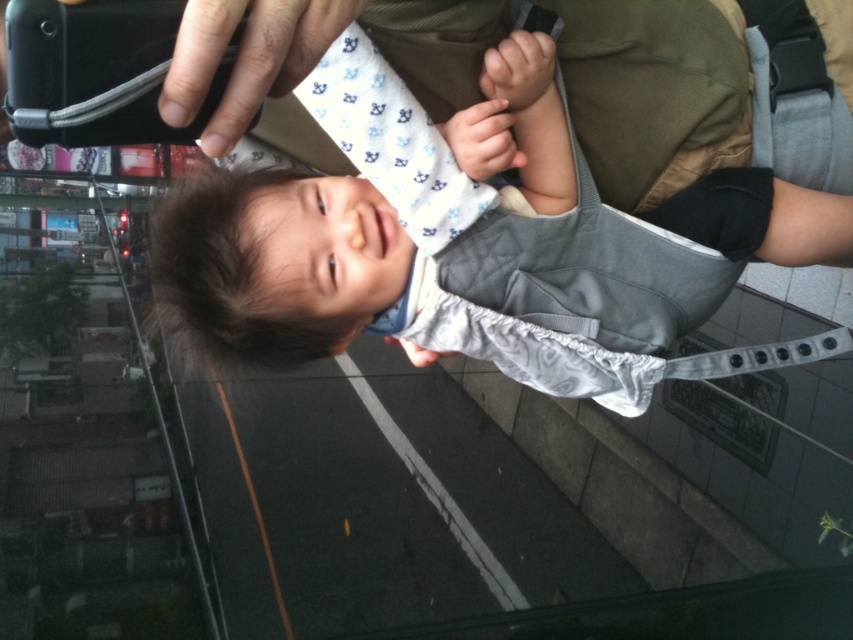
Question: Considering the relative positions of matte gray baby carrier at center and black matte phone at upper left in the image provided, where is matte gray baby carrier at center located with respect to black matte phone at upper left?

Choices:
 (A) above
 (B) below

Answer: (B)

Question: Which point is farther to the camera?

Choices:
 (A) black matte phone at upper left
 (B) matte gray baby carrier at center
 (C) smooth white hand at center

Answer: (C)

Question: Which object is the closest to the smooth white hand at center?

Choices:
 (A) black matte phone at upper left
 (B) matte gray baby carrier at center

Answer: (B)

Question: Does black matte phone at upper left have a larger size compared to smooth white hand at center?

Choices:
 (A) no
 (B) yes

Answer: (B)

Question: In this image, where is matte gray baby carrier at center located relative to smooth white hand at center?

Choices:
 (A) above
 (B) below

Answer: (B)

Question: Which of the following is the farthest from the observer?

Choices:
 (A) black matte phone at upper left
 (B) matte gray baby carrier at center

Answer: (B)